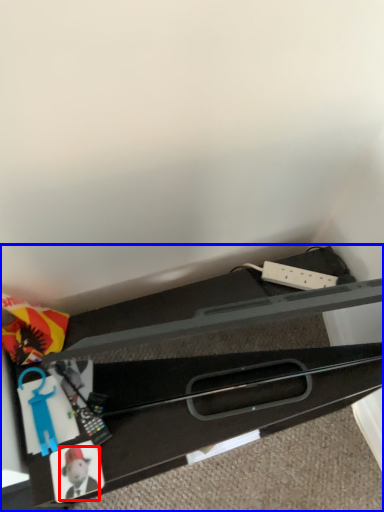
Question: Which object appears closest to the camera in this image, toy (highlighted by a red box) or furniture (highlighted by a blue box)?

Choices:
 (A) toy
 (B) furniture

Answer: (B)